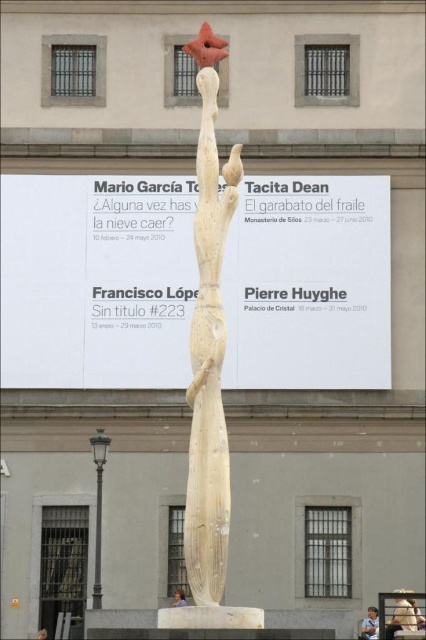
You are an artist who wants to create a miniature version of the sculpture in the scene. You have a piece of wood that is the same width as the light brown hair at center. Will this piece of wood be wide enough to carve the wooden statue at center?

The wooden statue at center is wider than the light brown hair at center, so the piece of wood with the same width as the light brown hair at center is not wide enough to carve the wooden statue at center.

You are a photographer taking a picture of the sculpture. You notice two people in the scene with light brown hair at center and blonde hair at center. Which person will appear closer to the camera in the photo?

The light brown hair at center appears closer to the camera because it is in front of the blonde hair at center in the scene.

You are a photographer trying to capture both the light brown hair at center and the blonde hair at center in a single frame. Based on their widths, which hair color might require you to adjust your camera angle to ensure both are fully visible?

The light brown hair at center might be wider than the blonde hair at center, so you might need to adjust your camera angle to accommodate its width to ensure both are fully visible.